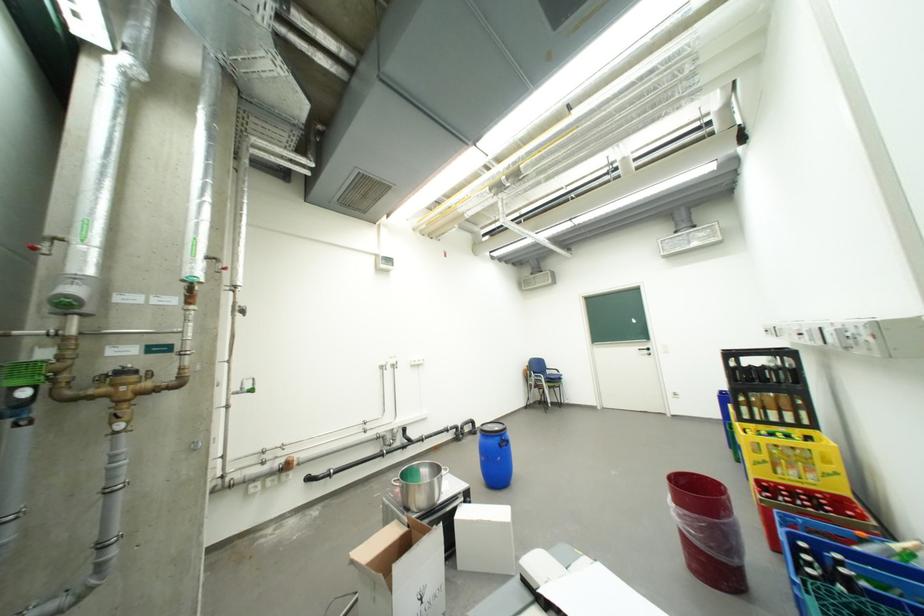
Where is `blue barrel handle`? The height and width of the screenshot is (616, 924). blue barrel handle is located at coordinates (503, 439).